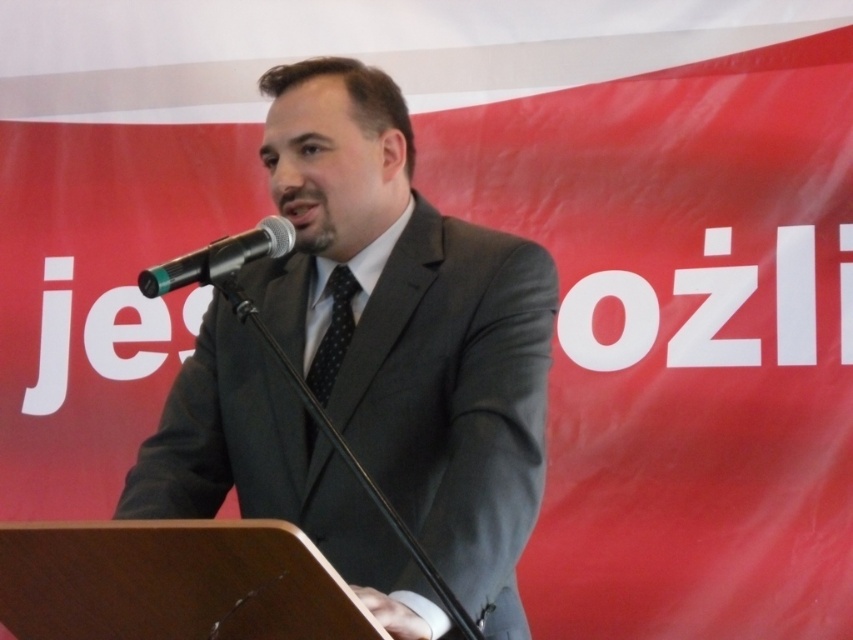
Which is above, matte gray suit at center or black dotted tie at center?

matte gray suit at center is above.

Is matte gray suit at center below black dotted tie at center?

Incorrect, matte gray suit at center is not positioned below black dotted tie at center.

The height and width of the screenshot is (640, 853). I want to click on matte gray suit at center, so click(412, 326).

Does matte gray suit at center appear on the right side of black metallic microphone at center?

Indeed, matte gray suit at center is positioned on the right side of black metallic microphone at center.

This screenshot has height=640, width=853. Identify the location of matte gray suit at center. (412, 326).

Is black metallic microphone at center smaller than black dotted tie at center?

Incorrect, black metallic microphone at center is not smaller in size than black dotted tie at center.

In the scene shown: Is black metallic microphone at center bigger than black dotted tie at center?

Correct, black metallic microphone at center is larger in size than black dotted tie at center.

Is point (247, 241) closer to viewer compared to point (334, 292)?

Yes, it is in front of point (334, 292).

At what (x,y) coordinates should I click in order to perform the action: click on black metallic microphone at center. Please return your answer as a coordinate pair (x, y). This screenshot has width=853, height=640. Looking at the image, I should click on (219, 259).